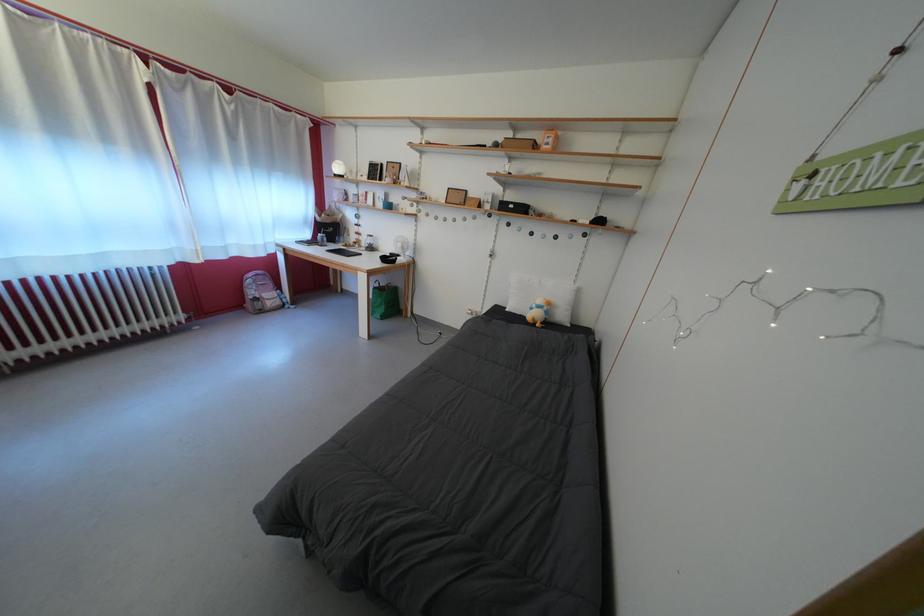
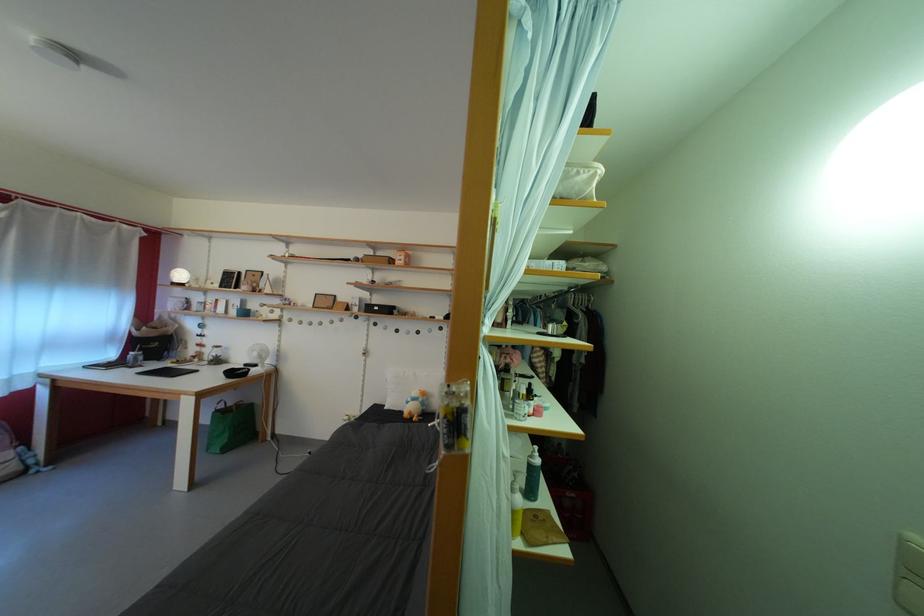
Which direction would the cameraman need to move to produce the second image?

The cameraman walked toward right, backward.